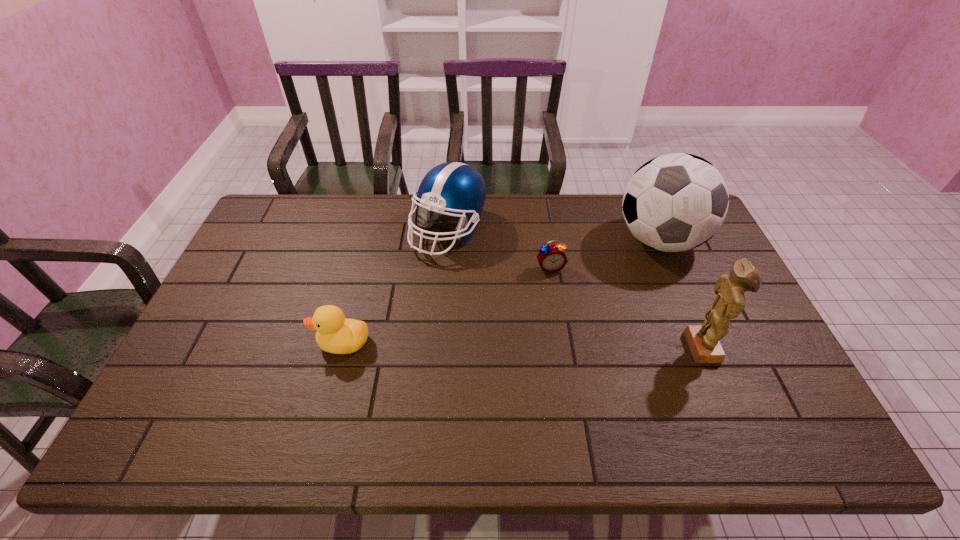
This screenshot has height=540, width=960. Identify the location of object that is the closest to the third shortest object. (551, 258).

The height and width of the screenshot is (540, 960). I want to click on object that is the closest to the soccer ball, so click(551, 258).